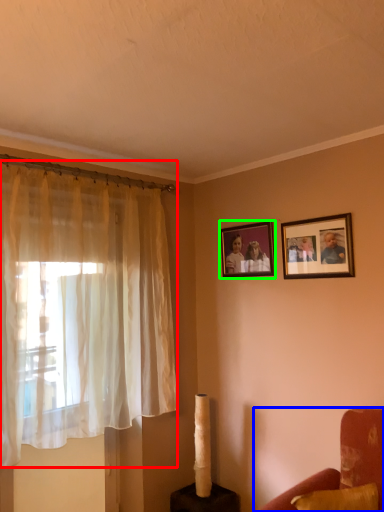
Question: Which object is positioned closest to curtain (highlighted by a red box)? Select from furniture (highlighted by a blue box) and picture frame (highlighted by a green box).

Choices:
 (A) furniture
 (B) picture frame

Answer: (B)